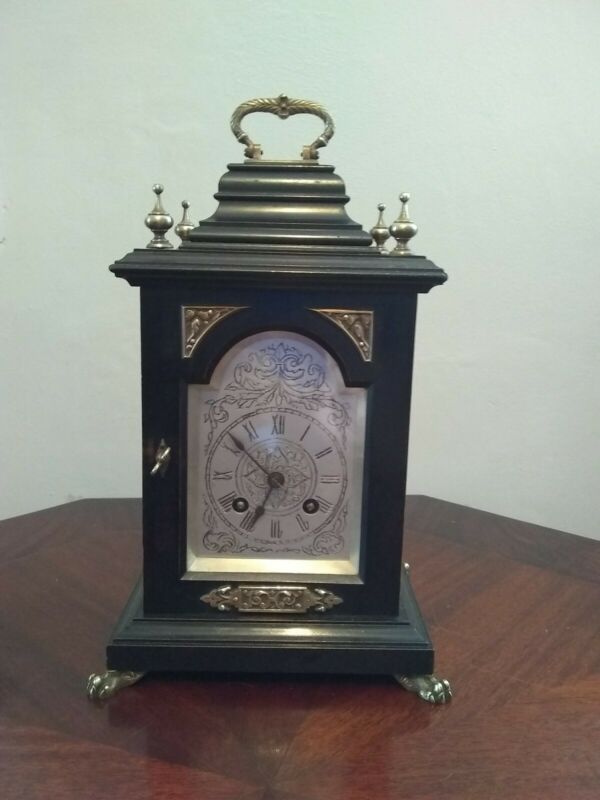
Where is `door locking mechanism`? door locking mechanism is located at coordinates (161, 454).